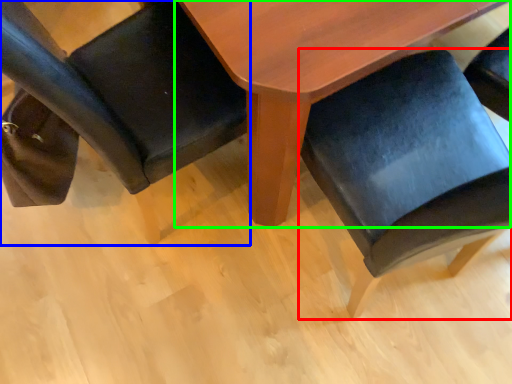
Question: Based on their relative distances, which object is nearer to chair (highlighted by a red box)? Choose from chair (highlighted by a blue box) and table (highlighted by a green box).

Choices:
 (A) chair
 (B) table

Answer: (B)